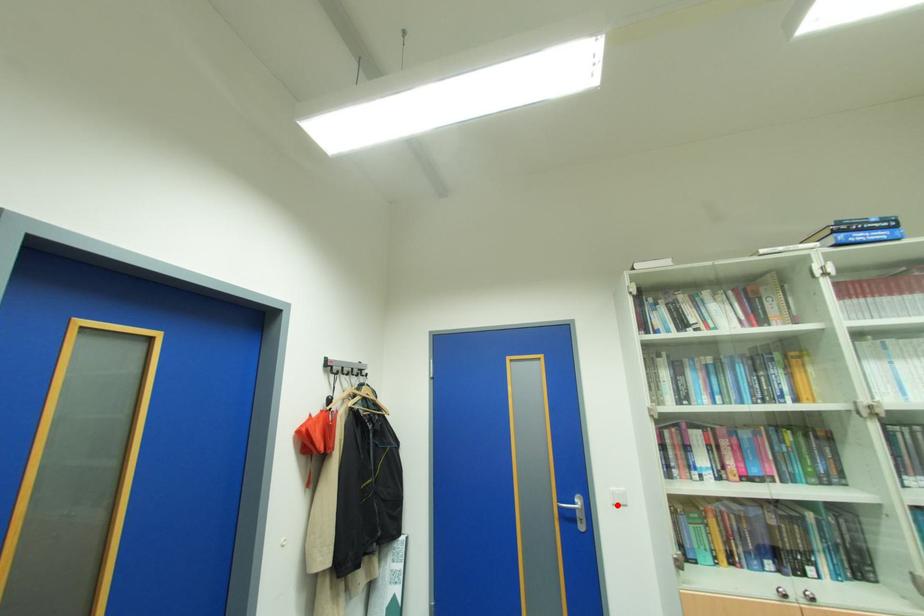
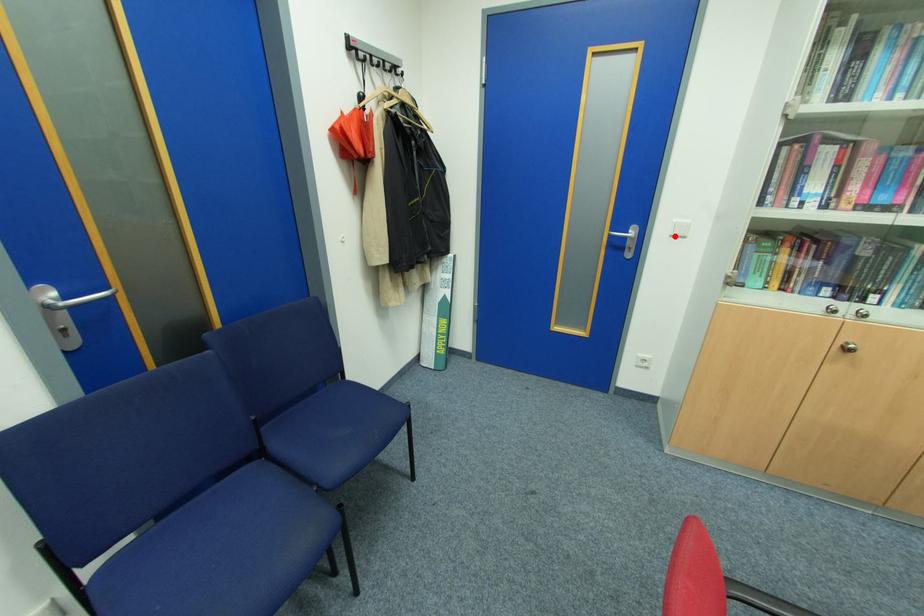
I am providing you with two images of the same scene from different viewpoints. A red point is marked on the first image and another point is marked on the second image. Do the highlighted points in image1 and image2 indicate the same real-world spot?

Yes